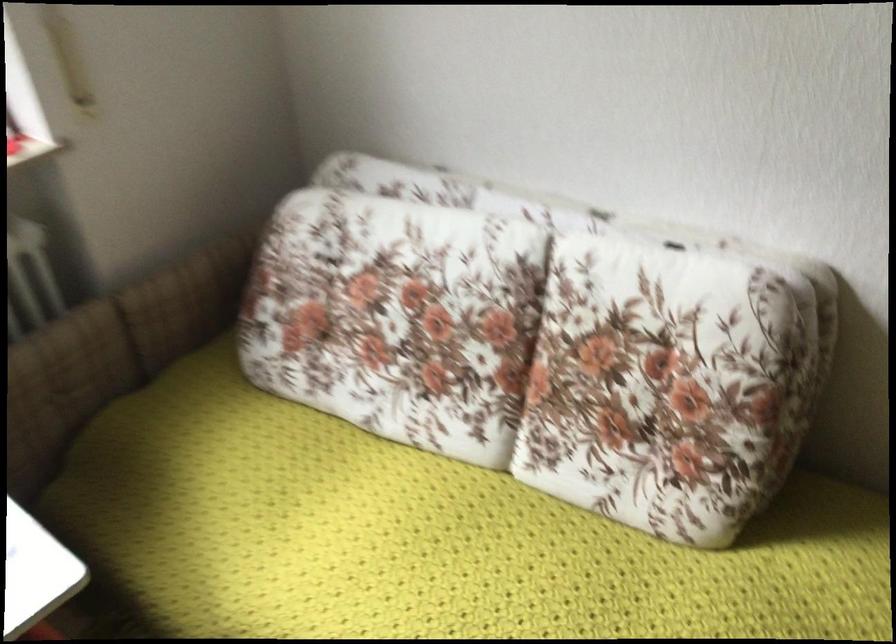
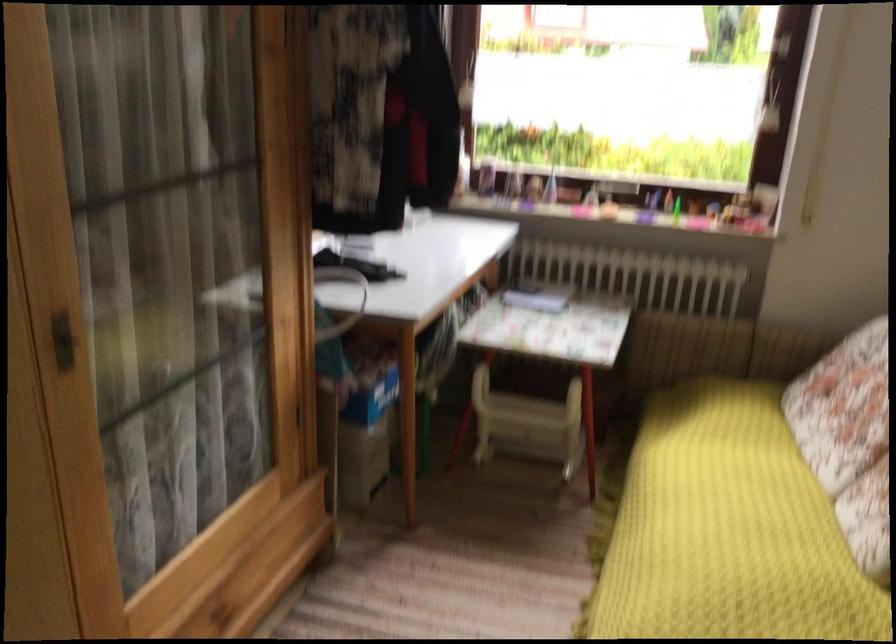
Find the pixel in the second image that matches [435,386] in the first image.

(849, 439)